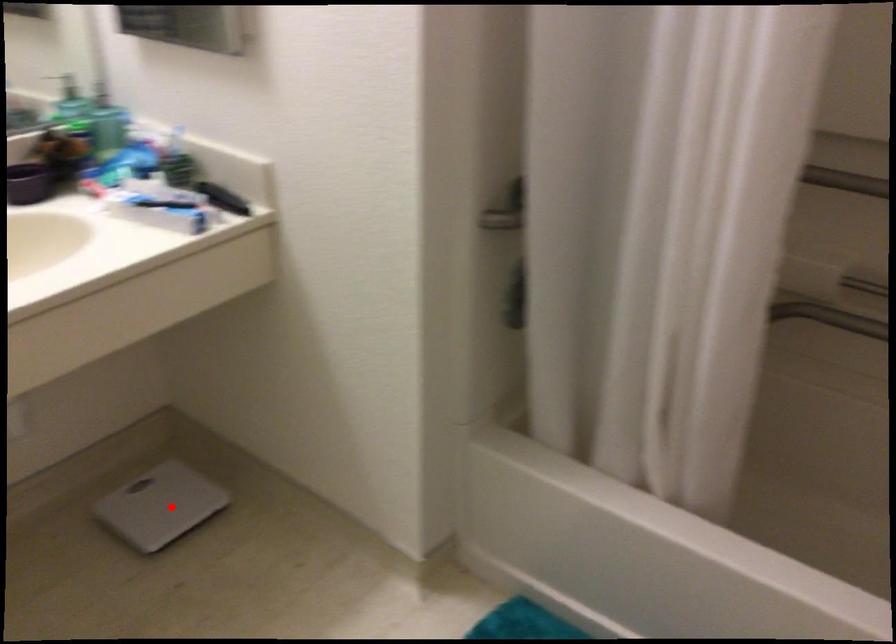
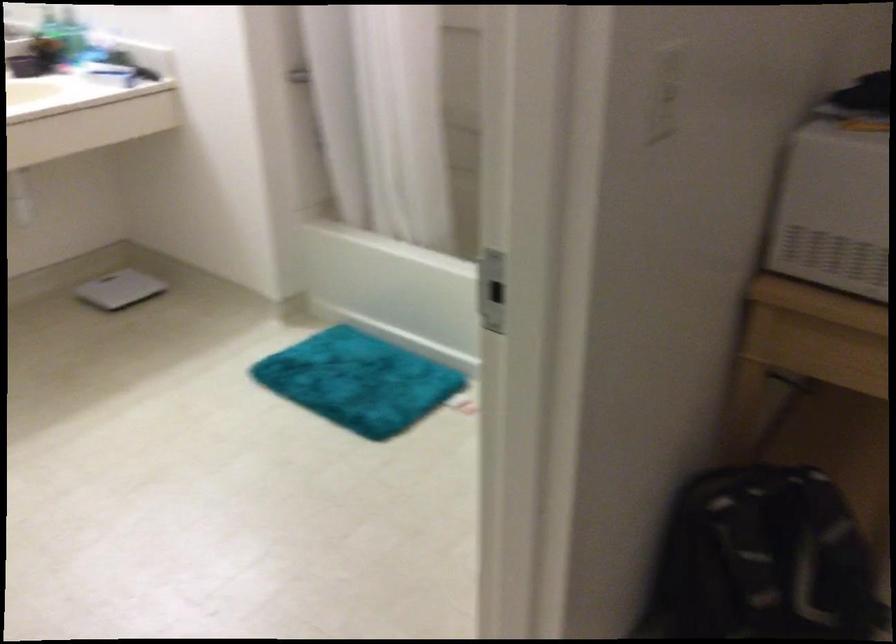
The point at the highlighted location is marked in the first image. Where is the corresponding point in the second image?

(119, 289)